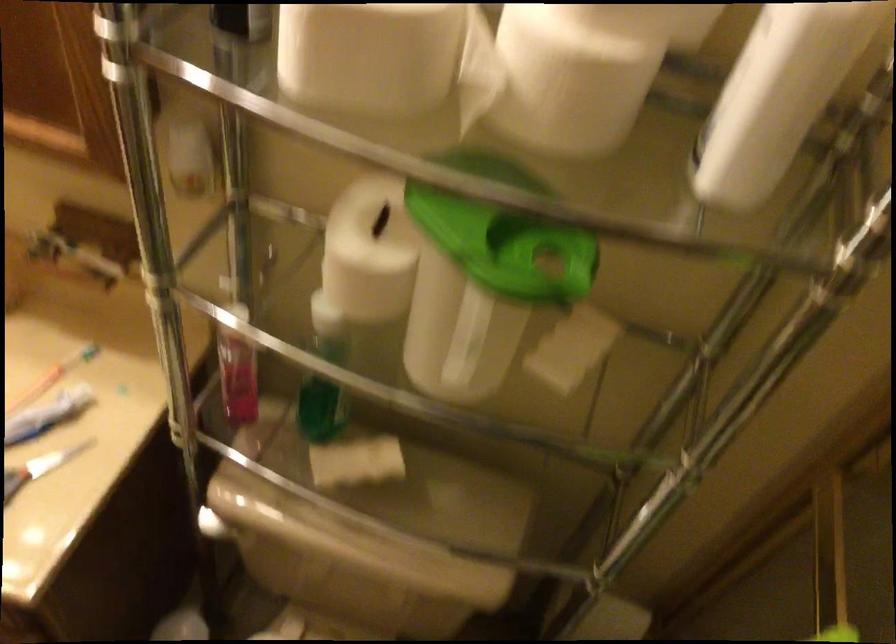
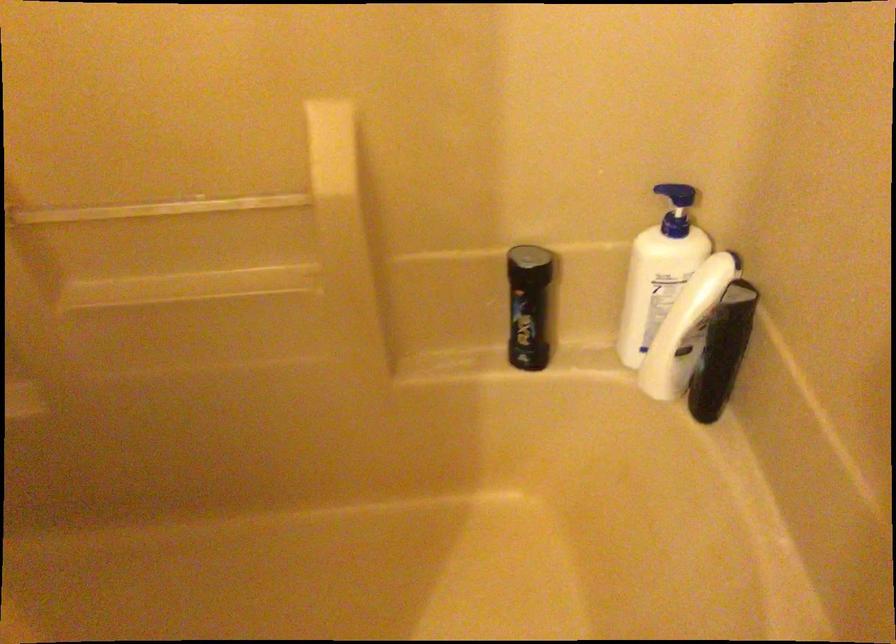
Consider the image. The images are taken continuously from a first-person perspective. In which direction is your viewpoint rotating?

The rotation direction of the camera is right-down.